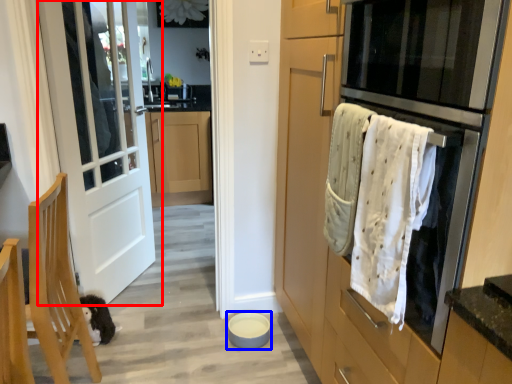
Question: Which point is closer to the camera, door (highlighted by a red box) or appliance (highlighted by a blue box)?

Choices:
 (A) door
 (B) appliance

Answer: (A)